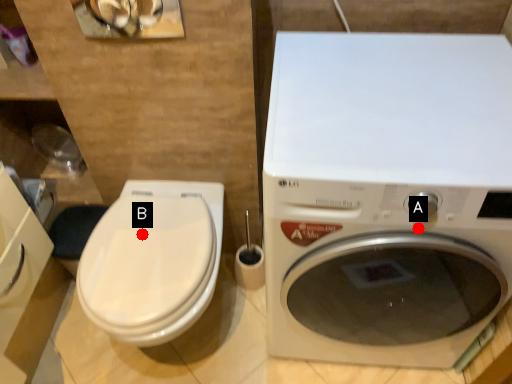
Question: Two points are circled on the image, labeled by A and B beside each circle. Which point appears farthest from the camera in this image?

Choices:
 (A) A is further
 (B) B is further

Answer: (B)